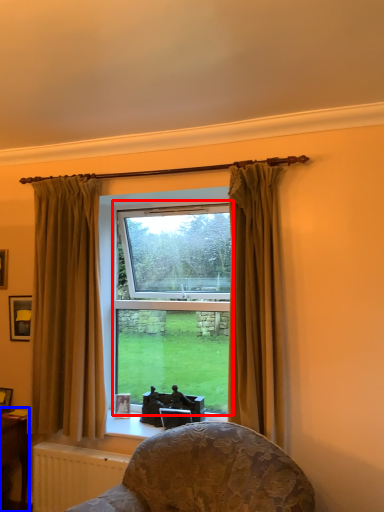
Question: Which point is further to the camera, bay window (highlighted by a red box) or table (highlighted by a blue box)?

Choices:
 (A) bay window
 (B) table

Answer: (A)